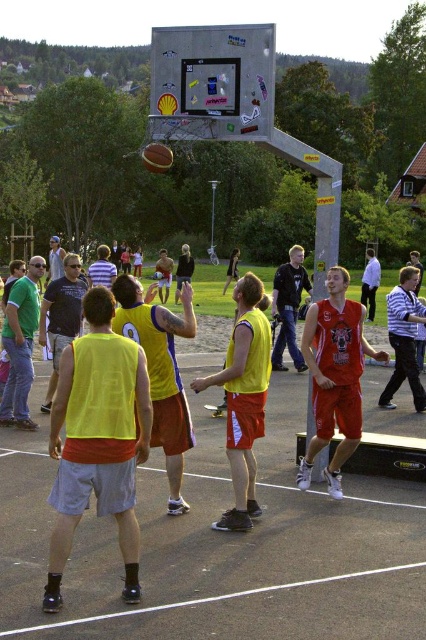
Who is positioned more to the left, neon yellow jersey at center or white cotton shirt at center?

Positioned to the left is neon yellow jersey at center.

Is neon yellow jersey at center thinner than white cotton shirt at center?

Indeed, neon yellow jersey at center has a lesser width compared to white cotton shirt at center.

Which is behind, point (124, 516) or point (368, 264)?

The point (368, 264) is behind.

I want to click on neon yellow jersey at center, so click(x=97, y=440).

Can you confirm if matte red shorts at center is smaller than matte yellow jersey at center?

Yes.

Does point (339, 344) come farther from viewer compared to point (52, 273)?

No, (339, 344) is in front of (52, 273).

Is point (354, 428) more distant than point (63, 253)?

No, (354, 428) is closer to viewer.

Locate an element on the screen. This screenshot has width=426, height=640. matte red shorts at center is located at coordinates (334, 376).

Between neon yellow jersey at left and white cotton shirt at center, which one has less height?

Standing shorter between the two is neon yellow jersey at left.

Is neon yellow jersey at left above white cotton shirt at center?

No.

Does point (26, 323) lie behind point (368, 262)?

That is False.

The height and width of the screenshot is (640, 426). Find the location of `neon yellow jersey at left`. neon yellow jersey at left is located at coordinates (20, 344).